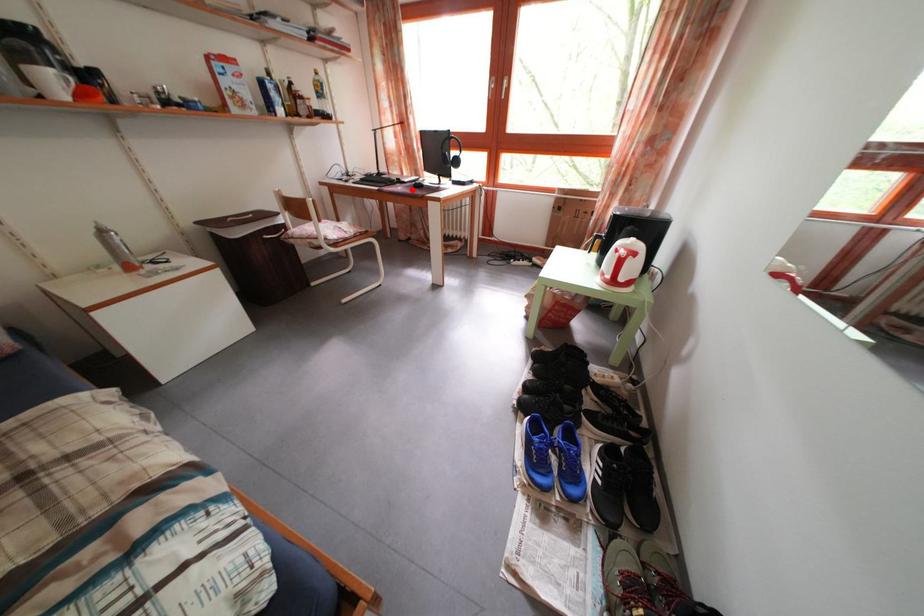
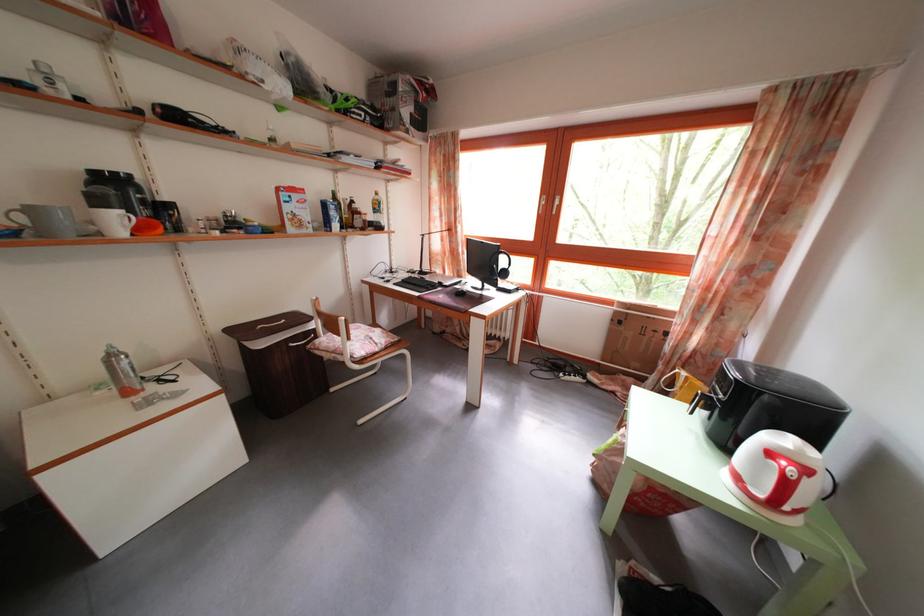
Question: I am providing you with two images of the same scene from different viewpoints. Given a red point in image1, look at the same physical point in image2. Is it:

Choices:
 (A) Closer to the viewpoint
 (B) Farther from the viewpoint

Answer: (B)